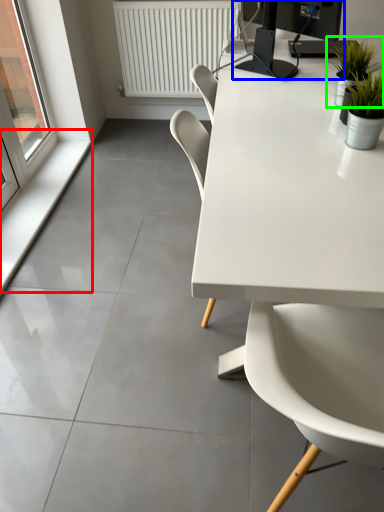
Question: Based on their relative distances, which object is farther from window sill (highlighted by a red box)? Choose from desktop computer (highlighted by a blue box) and houseplant (highlighted by a green box).

Choices:
 (A) desktop computer
 (B) houseplant

Answer: (B)